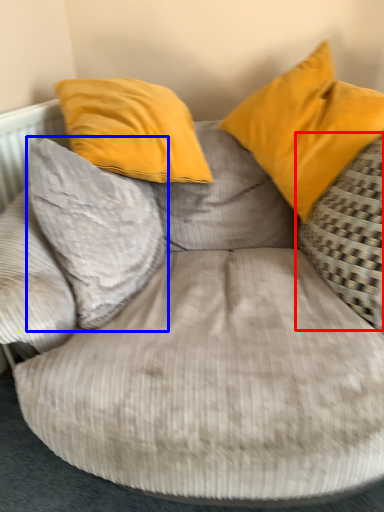
Question: Which object is further to the camera taking this photo, pillow (highlighted by a red box) or pillow (highlighted by a blue box)?

Choices:
 (A) pillow
 (B) pillow

Answer: (B)